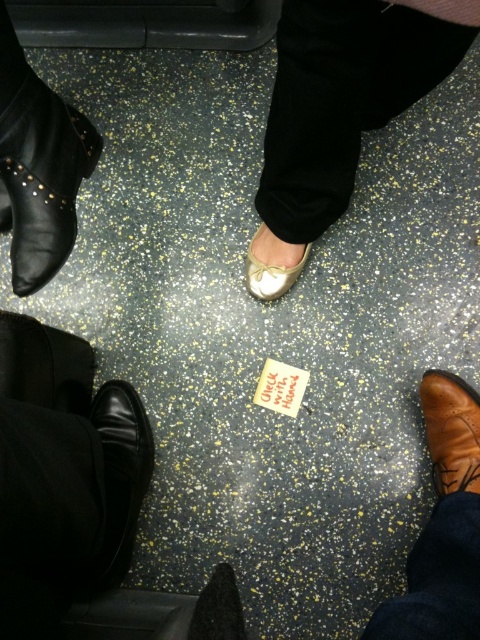
Can you confirm if black leather boot at left is smaller than brown leather boot at lower right?

No, black leather boot at left is not smaller than brown leather boot at lower right.

Looking at this image, does black leather boot at left have a lesser width compared to brown leather boot at lower right?

In fact, black leather boot at left might be wider than brown leather boot at lower right.

Is point (27, 88) closer to viewer compared to point (452, 449)?

Yes, it is.

This screenshot has height=640, width=480. Identify the location of black leather boot at left. (43, 179).

Is point (130, 456) farther from camera compared to point (272, 294)?

No, (130, 456) is closer to viewer.

How distant is shiny black shoe at lower left from white leather shoe at center?

The distance of shiny black shoe at lower left from white leather shoe at center is 38.98 centimeters.

Measure the distance between shiny black shoe at lower left and camera.

The distance of shiny black shoe at lower left from camera is 33.69 inches.

The width and height of the screenshot is (480, 640). Identify the location of shiny black shoe at lower left. (120, 476).

Is shiny black shoe at lower left taller than brown leather boot at lower right?

Indeed, shiny black shoe at lower left has a greater height compared to brown leather boot at lower right.

Who is more forward, (108,461) or (433,417)?

Point (108,461) is in front.

In order to click on shiny black shoe at lower left in this screenshot , I will do `click(120, 476)`.

Where is `shiny black shoe at lower left`? The height and width of the screenshot is (640, 480). shiny black shoe at lower left is located at coordinates (120, 476).